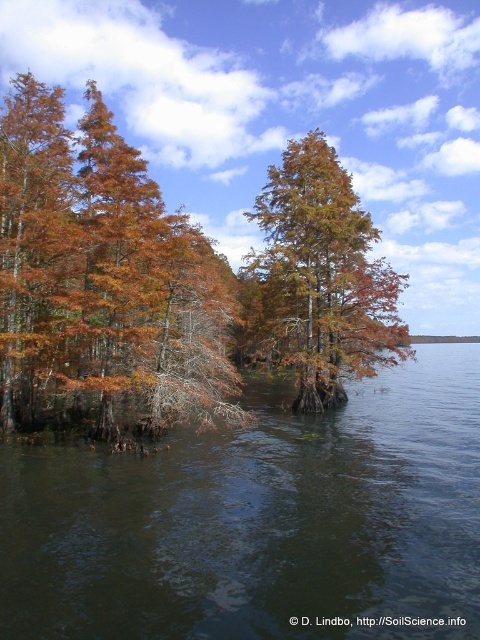
Can you confirm if orange-brown bark tree at upper left is thinner than orange matte tree at center?

No.

Does orange-brown bark tree at upper left appear over orange matte tree at center?

Indeed, orange-brown bark tree at upper left is positioned over orange matte tree at center.

Image resolution: width=480 pixels, height=640 pixels. I want to click on orange-brown bark tree at upper left, so click(103, 284).

Locate an element on the screen. Image resolution: width=480 pixels, height=640 pixels. orange-brown bark tree at upper left is located at coordinates (103, 284).

Does brown murky water at lower left appear over orange-brown bark tree at upper left?

No.

Between brown murky water at lower left and orange-brown bark tree at upper left, which one is positioned lower?

brown murky water at lower left is below.

Which is behind, point (261, 396) or point (217, 403)?

Positioned behind is point (261, 396).

The width and height of the screenshot is (480, 640). Find the location of `brown murky water at lower left`. brown murky water at lower left is located at coordinates (x=260, y=522).

Who is taller, brown murky water at lower left or orange matte tree at center?

With more height is orange matte tree at center.

This screenshot has height=640, width=480. I want to click on brown murky water at lower left, so click(x=260, y=522).